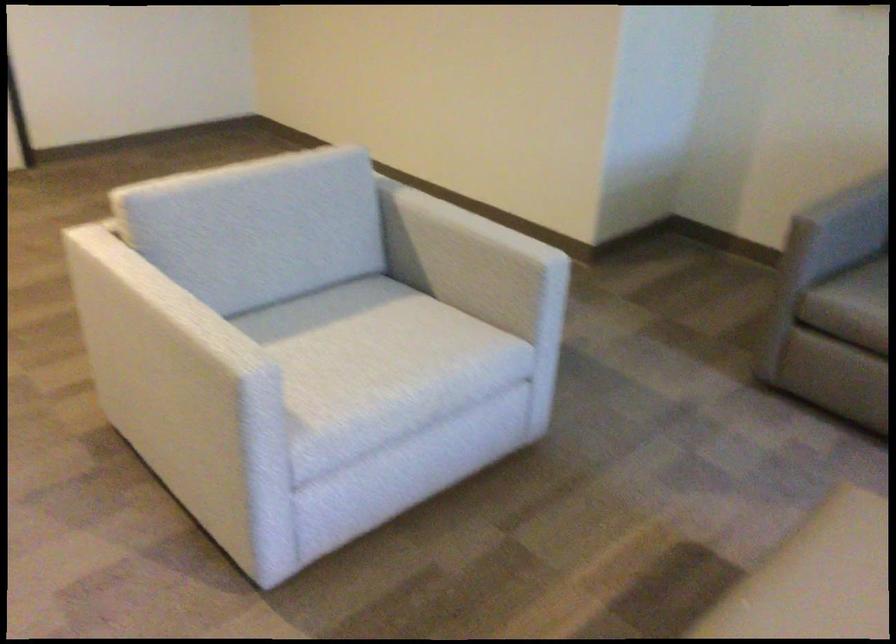
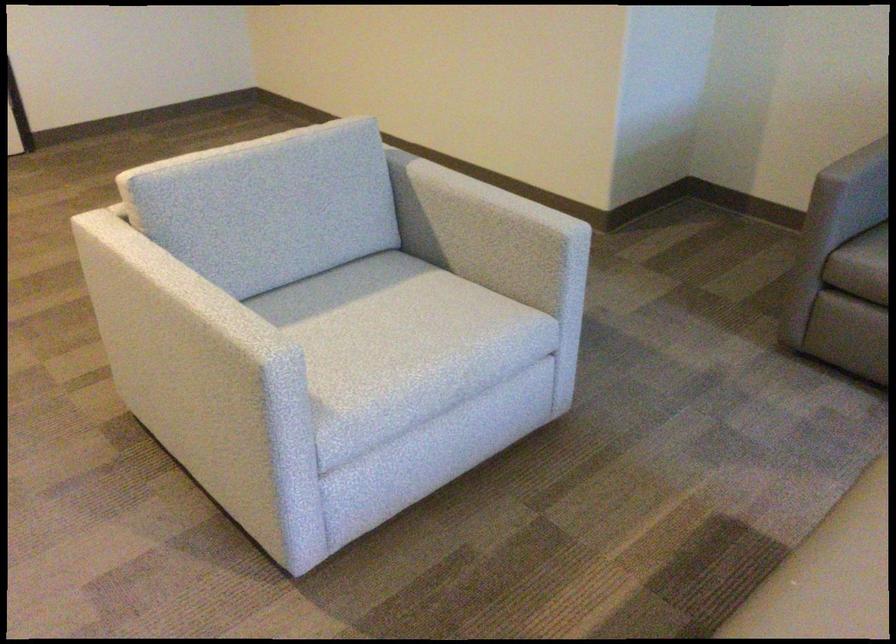
Locate, in the second image, the point that corresponds to the point at 405,355 in the first image.

(427, 333)